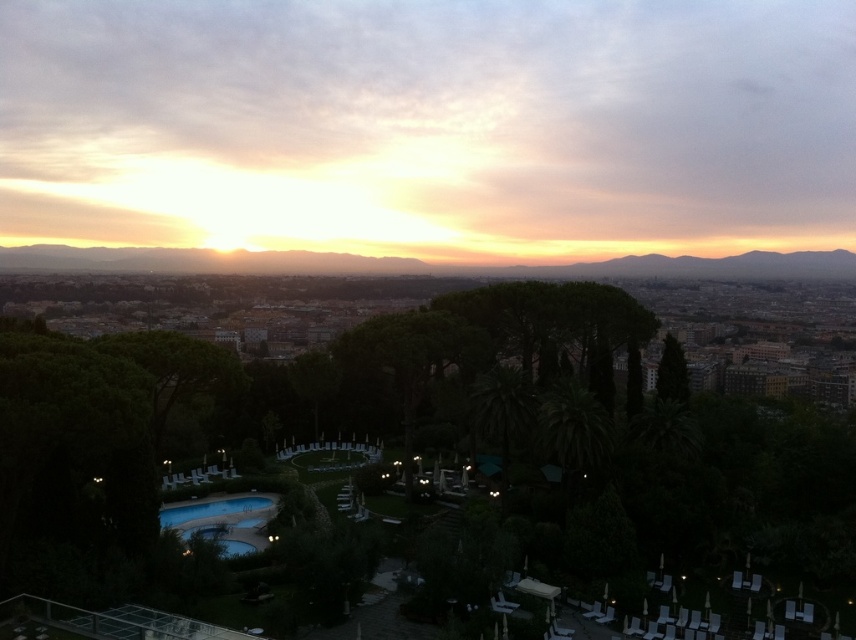
Question: Observing the image, what is the correct spatial positioning of golden sky at center in reference to blue glass pool at lower left?

Choices:
 (A) right
 (B) left

Answer: (A)

Question: Is golden sky at center to the left of blue glass pool at lower left from the viewer's perspective?

Choices:
 (A) no
 (B) yes

Answer: (A)

Question: Can you confirm if golden sky at center is bigger than blue glass pool at lower left?

Choices:
 (A) no
 (B) yes

Answer: (B)